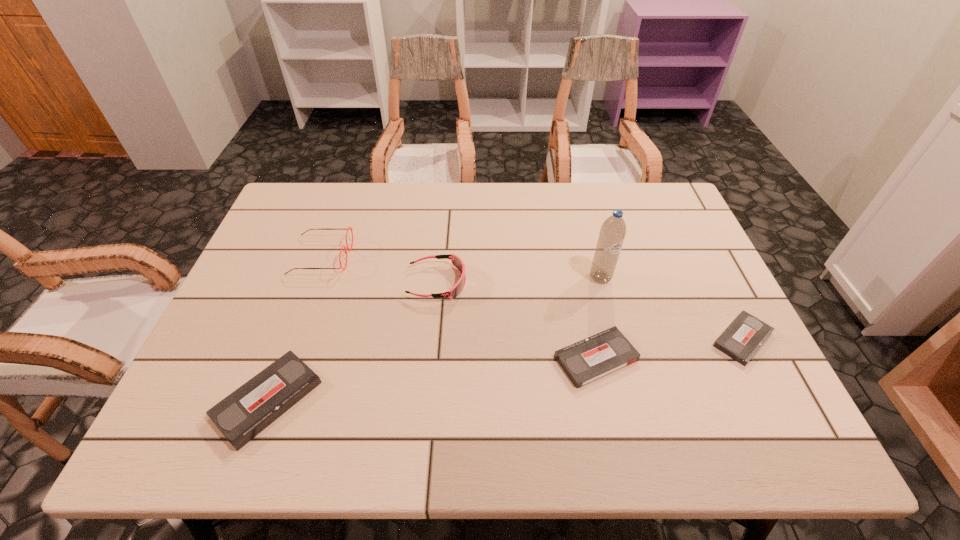
Select which videotape is the second closest to the second videotape from right to left. Please provide its 2D coordinates. Your answer should be formatted as a tuple, i.e. [(x, y)], where the tuple contains the x and y coordinates of a point satisfying the conditions above.

[(246, 412)]

The image size is (960, 540). In order to click on vacant space that satisfies the following two spatial constraints: 1. on the front-facing side of the second videotape from right to left; 2. on the left side of the third tallest object in this screenshot , I will do `click(430, 358)`.

The image size is (960, 540). I want to click on vacant space that satisfies the following two spatial constraints: 1. on the front-facing side of the spectacles; 2. on the left side of the tallest object, so click(314, 278).

This screenshot has width=960, height=540. I want to click on vacant point that satisfies the following two spatial constraints: 1. on the front-facing side of the goggles; 2. on the right side of the rightmost object, so click(432, 339).

Locate an element on the screen. blank space that satisfies the following two spatial constraints: 1. on the front-facing side of the second shortest videotape; 2. on the left side of the goggles is located at coordinates (430, 358).

At what (x,y) coordinates should I click in order to perform the action: click on vacant region that satisfies the following two spatial constraints: 1. on the back side of the shortest videotape; 2. on the front-facing side of the goggles. Please return your answer as a coordinate pair (x, y). This screenshot has height=540, width=960. Looking at the image, I should click on (714, 283).

At what (x,y) coordinates should I click in order to perform the action: click on free space that satisfies the following two spatial constraints: 1. on the front side of the rightmost object; 2. on the left side of the tallest object. Please return your answer as a coordinate pair (x, y). The width and height of the screenshot is (960, 540). Looking at the image, I should click on (616, 339).

This screenshot has width=960, height=540. Find the location of `free spot that satisfies the following two spatial constraints: 1. on the back side of the rightmost object; 2. on the right side of the second videotape from right to left`. free spot that satisfies the following two spatial constraints: 1. on the back side of the rightmost object; 2. on the right side of the second videotape from right to left is located at coordinates (592, 339).

Identify the location of free location that satisfies the following two spatial constraints: 1. on the front-facing side of the spectacles; 2. on the back side of the tallest object. (314, 278).